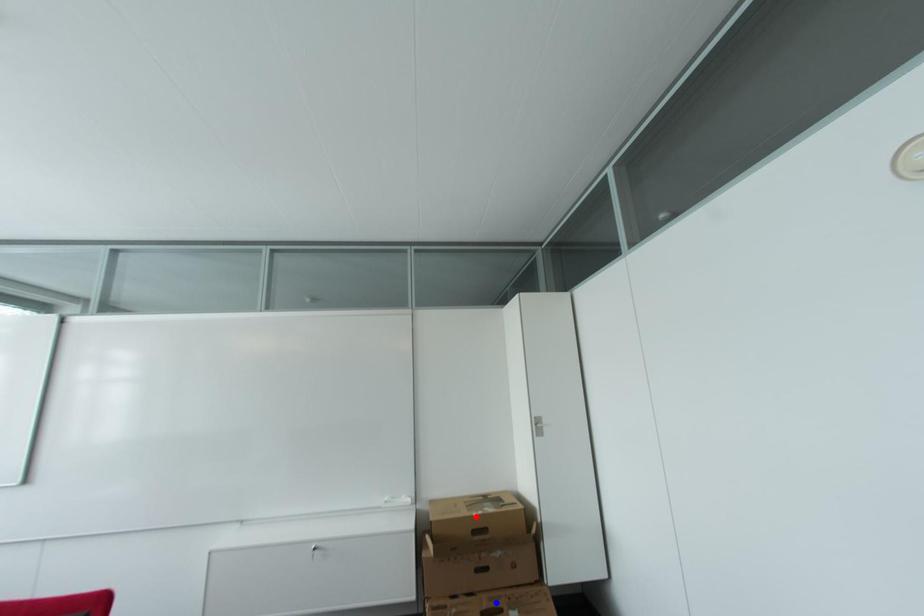
Question: Which of the two points in the image is closer to the camera?

Choices:
 (A) Blue point is closer.
 (B) Red point is closer.

Answer: (A)